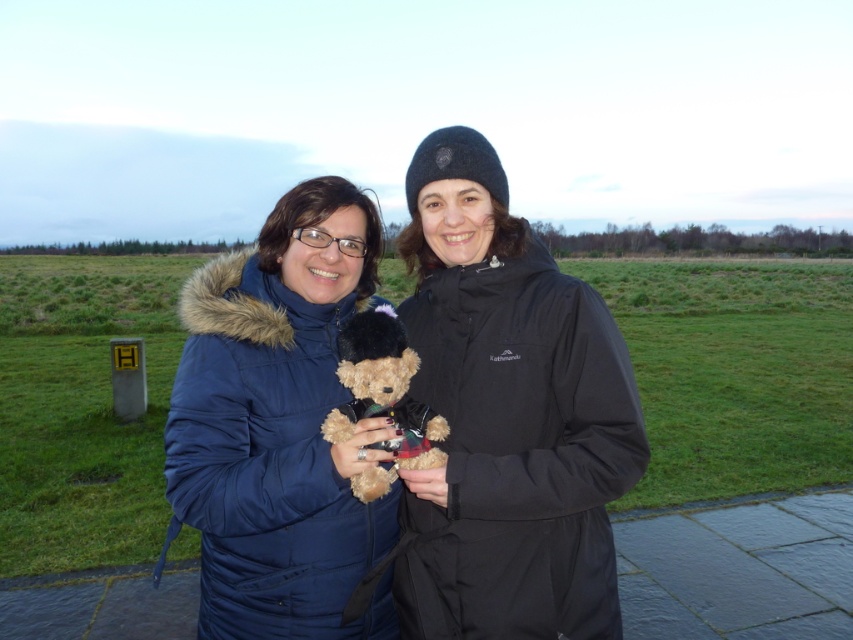
Between black softshell jacket at center and velvet blue coat at center, which one appears on the left side from the viewer's perspective?

Positioned to the left is velvet blue coat at center.

Does black softshell jacket at center have a greater width compared to velvet blue coat at center?

No.

Between point (556, 500) and point (308, 547), which one is positioned behind?

Point (308, 547)

Where is `black softshell jacket at center`? This screenshot has width=853, height=640. black softshell jacket at center is located at coordinates (508, 417).

Can you confirm if black softshell jacket at center is positioned below fuzzy brown teddy bear at center?

No, black softshell jacket at center is not below fuzzy brown teddy bear at center.

Is black softshell jacket at center shorter than fuzzy brown teddy bear at center?

No, black softshell jacket at center is not shorter than fuzzy brown teddy bear at center.

The image size is (853, 640). Identify the location of black softshell jacket at center. 508,417.

Based on the photo, measure the distance between velvet blue coat at center and fuzzy brown teddy bear at center.

6.36 inches

From the picture: Between velvet blue coat at center and fuzzy brown teddy bear at center, which one has more height?

With more height is velvet blue coat at center.

Where is `velvet blue coat at center`? Image resolution: width=853 pixels, height=640 pixels. velvet blue coat at center is located at coordinates (276, 426).